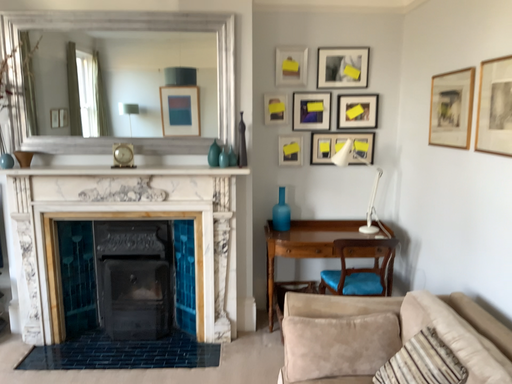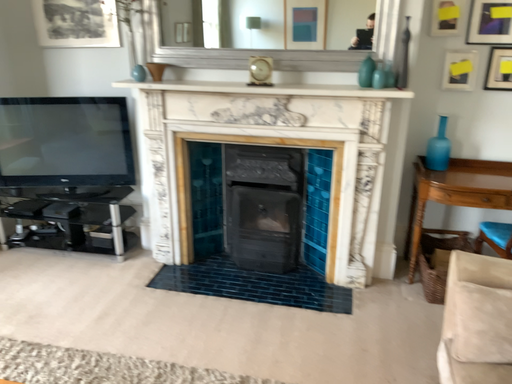
Question: How did the camera likely rotate when shooting the video?

Choices:
 (A) rotated downward
 (B) rotated upward

Answer: (A)